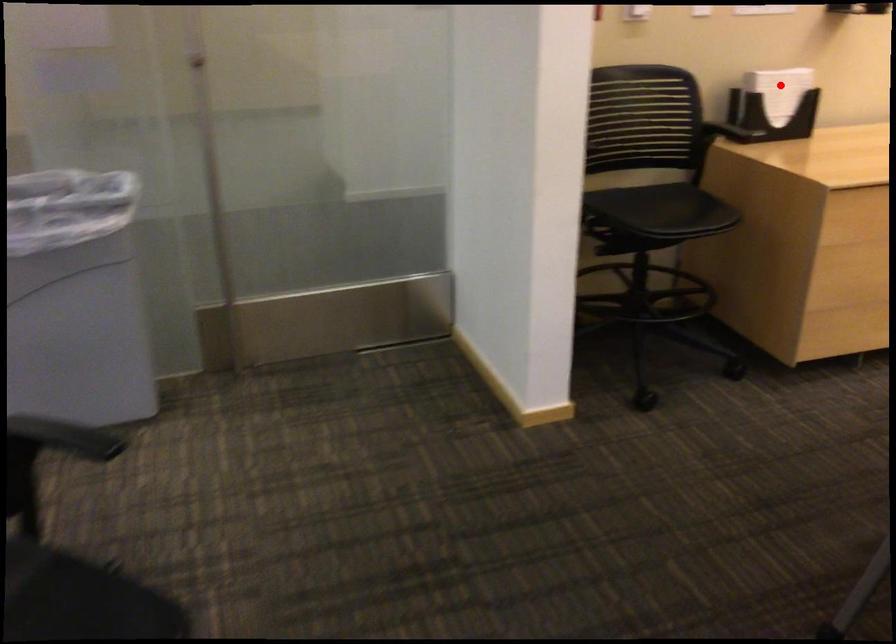
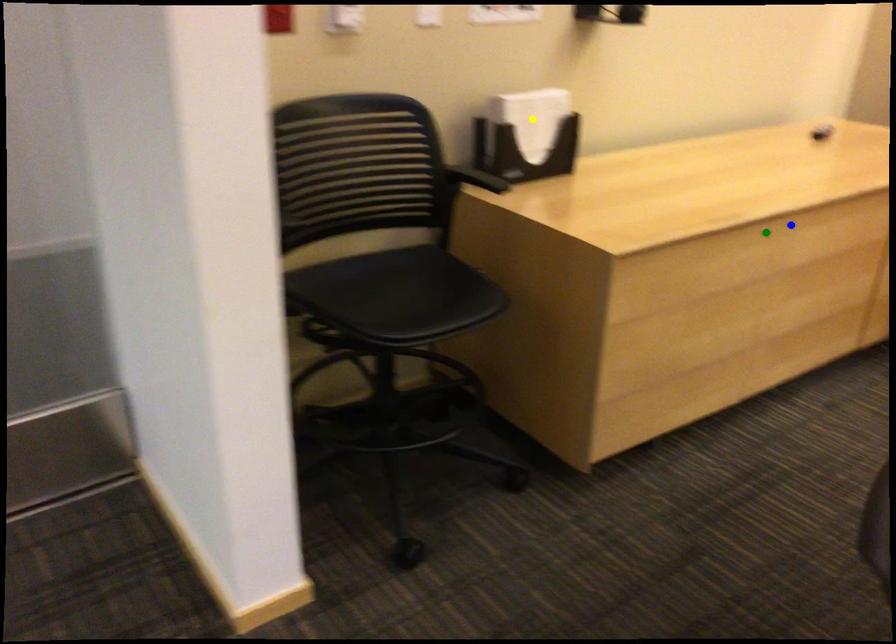
Question: I am providing you with two images of the same scene from different viewpoints. A red point is marked on the first image. You are given multiple points on the second image. Which spot in image 2 lines up with the point in image 1?

Choices:
 (A) green point
 (B) blue point
 (C) yellow point

Answer: (C)